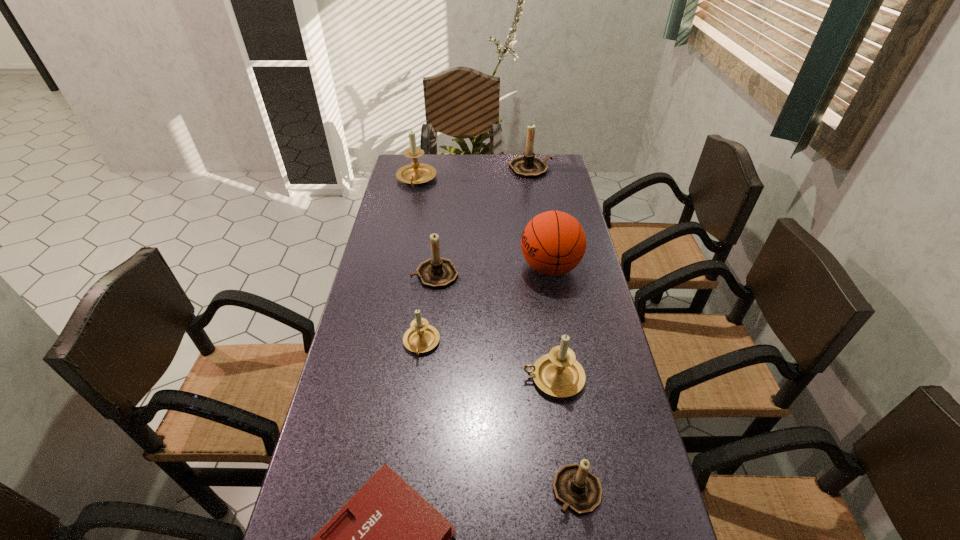
Locate an element on the screen. The height and width of the screenshot is (540, 960). basketball that is at the right edge is located at coordinates (553, 243).

This screenshot has width=960, height=540. Identify the location of object located in the far left corner section of the desktop. (415, 173).

Identify the location of object present at the far right corner. This screenshot has width=960, height=540. (528, 166).

In the image, there is a desktop. Identify the location of free space at the far edge. Image resolution: width=960 pixels, height=540 pixels. (450, 164).

The width and height of the screenshot is (960, 540). In order to click on free space at the left edge of the desktop in this screenshot , I will do `click(395, 234)`.

Where is `free space at the right edge of the desktop`? Image resolution: width=960 pixels, height=540 pixels. free space at the right edge of the desktop is located at coordinates 585,259.

Locate an element on the screen. free space at the far right corner of the desktop is located at coordinates (541, 159).

Identify the location of unoccupied position between the second biggest beige candle holder and the smallest brown candle holder. (565, 434).

Find the location of a particular element. free space between the basketball and the rightmost beige candle holder is located at coordinates (552, 323).

Where is `free space between the third farthest candle holder and the smallest beige candle holder`? The width and height of the screenshot is (960, 540). free space between the third farthest candle holder and the smallest beige candle holder is located at coordinates (428, 309).